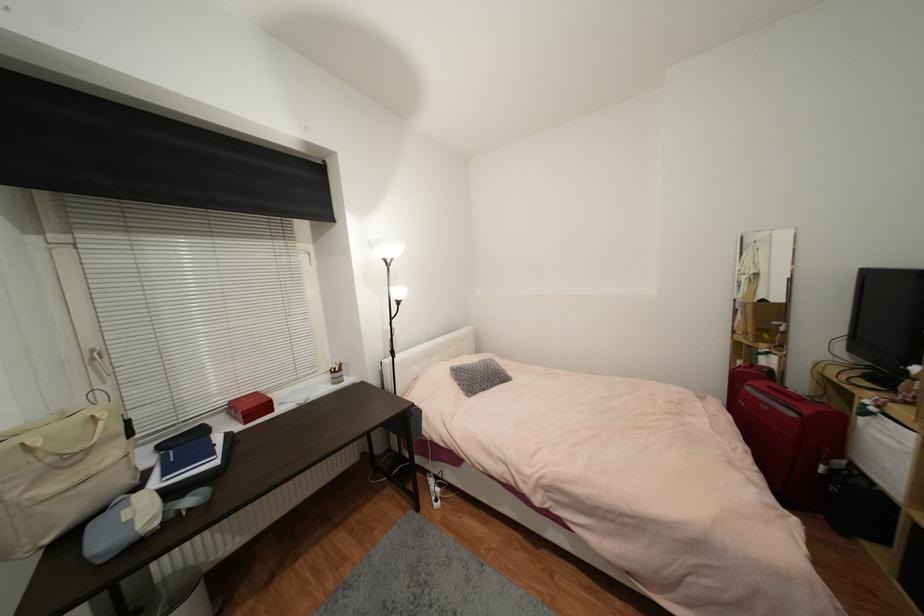
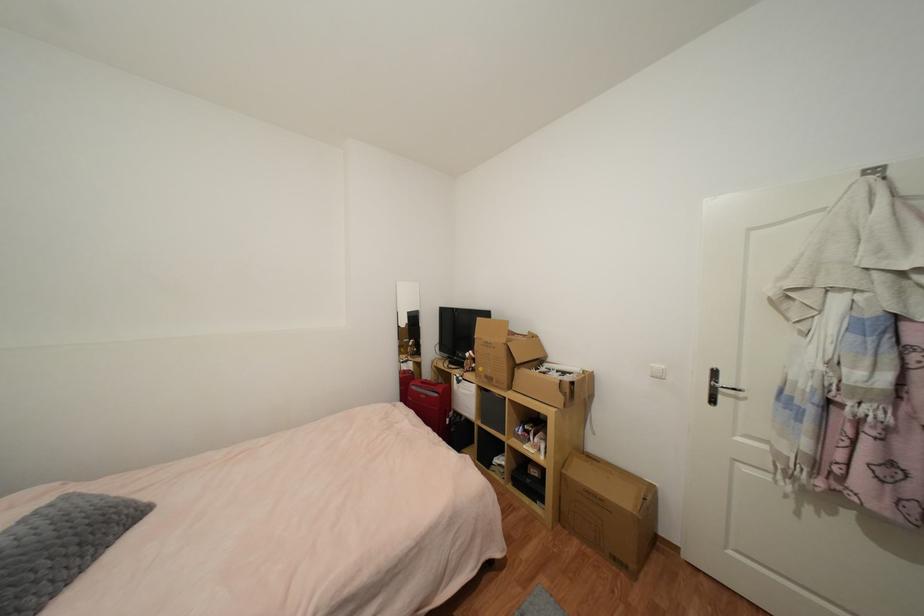
Question: The camera is either moving clockwise (left) or counter-clockwise (right) around the object. The first image is from the beginning of the video and the second image is from the end. Is the camera moving left or right when shooting the video?

Choices:
 (A) Left
 (B) Right

Answer: (A)